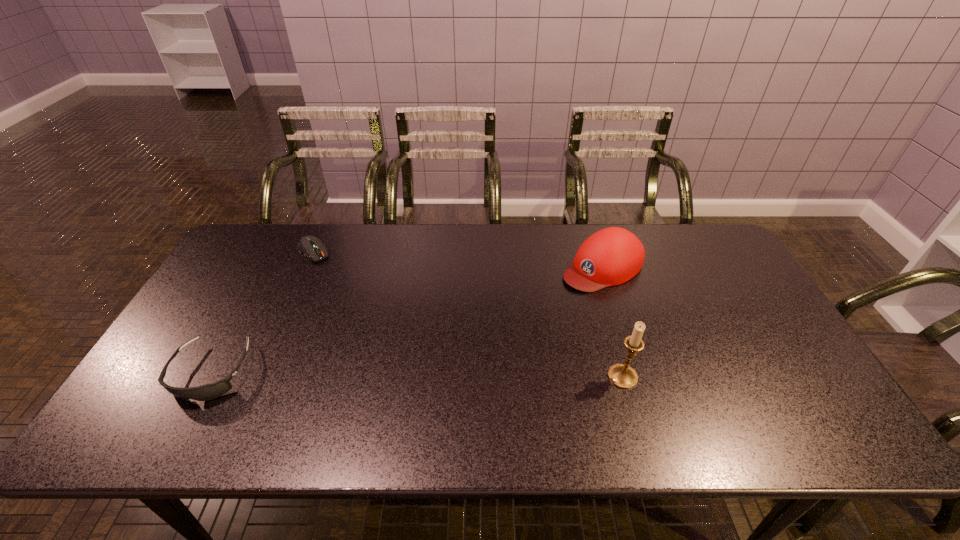
The width and height of the screenshot is (960, 540). In order to click on free space located on the button of the computer equipment in this screenshot , I will do `click(331, 272)`.

Where is `baseball cap that is at the far edge`? The width and height of the screenshot is (960, 540). baseball cap that is at the far edge is located at coordinates (612, 256).

At what (x,y) coordinates should I click in order to perform the action: click on computer equipment at the far edge. Please return your answer as a coordinate pair (x, y). The width and height of the screenshot is (960, 540). Looking at the image, I should click on (310, 246).

The image size is (960, 540). Identify the location of goggles that is at the near edge. (210, 391).

You are a GUI agent. You are given a task and a screenshot of the screen. Output one action in this format:
    pyautogui.click(x=<x>, y=<y>)
    Task: Click on the candle holder that is at the near edge
    
    Given the screenshot: What is the action you would take?
    pyautogui.click(x=621, y=375)

In order to click on object present at the left edge in this screenshot , I will do `click(210, 391)`.

Identify the location of object at the near left corner. The image size is (960, 540). (210, 391).

Identify the location of vacant space at the far edge of the desktop. This screenshot has width=960, height=540. (542, 245).

Image resolution: width=960 pixels, height=540 pixels. What are the coordinates of `vacant region at the near edge` in the screenshot? It's located at [383, 406].

This screenshot has height=540, width=960. I want to click on free spot at the left edge of the desktop, so click(176, 343).